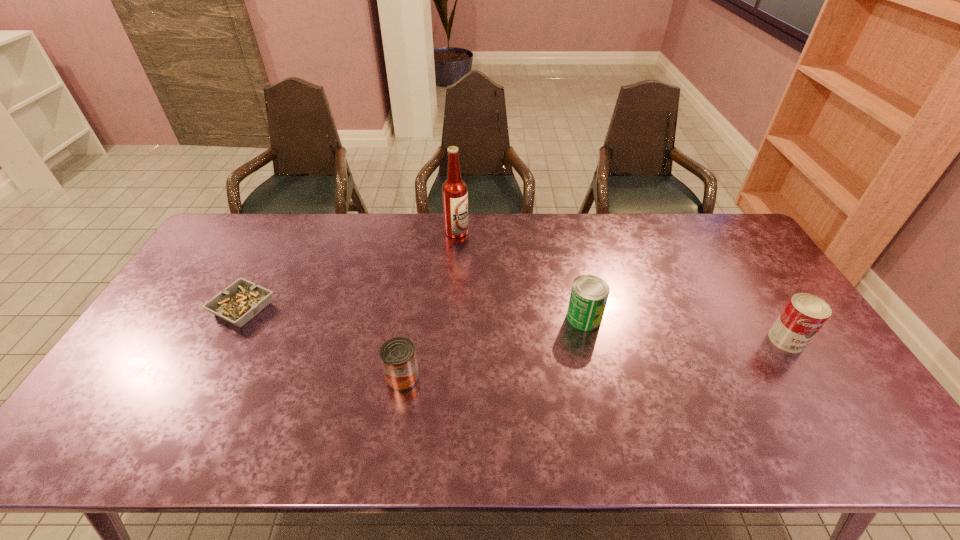
The image size is (960, 540). In order to click on vacant region located on the front of the second object from right to left in this screenshot , I will do `click(602, 396)`.

Locate an element on the screen. The width and height of the screenshot is (960, 540). free region located on the left of the second object from left to right is located at coordinates (282, 377).

Find the location of a particular element. vacant area situated on the front of the shortest object is located at coordinates (189, 408).

Locate an element on the screen. This screenshot has width=960, height=540. object located at the far edge is located at coordinates tap(454, 190).

Where is `object positioned at the left edge`? object positioned at the left edge is located at coordinates (242, 300).

What are the coordinates of `object that is positioned at the right edge` in the screenshot? It's located at (804, 314).

The height and width of the screenshot is (540, 960). Identify the location of vacant space at the far edge. (588, 254).

The image size is (960, 540). In order to click on vacant region at the near edge of the desktop in this screenshot , I will do `click(519, 452)`.

Identify the location of vacant space at the left edge of the desktop. (183, 312).

In the image, there is a desktop. Identify the location of free space at the right edge. Image resolution: width=960 pixels, height=540 pixels. (751, 284).